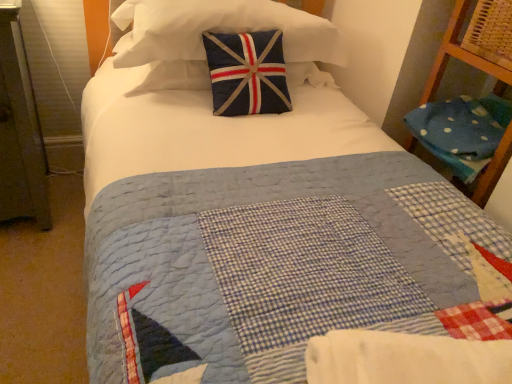
What do you see at coordinates (219, 30) in the screenshot? Image resolution: width=512 pixels, height=384 pixels. I see `navy blue fabric pillow at upper center, the 2th pillow in the bottom-to-top sequence` at bounding box center [219, 30].

What is the approximate width of white cotton blanket at center?

white cotton blanket at center is 11.24 inches wide.

Locate an element on the screen. blue polka dot fabric at right, which appears as the 2th pillow when viewed from the left is located at coordinates (461, 126).

You are a GUI agent. You are given a task and a screenshot of the screen. Output one action in this format:
    pyautogui.click(x=<x>, y=<y>)
    Task: Click on the 2nd pillow positioned above the white cotton blanket at center (from the image's perspective)
    This screenshot has width=512, height=384.
    Given the screenshot: What is the action you would take?
    pyautogui.click(x=219, y=30)

How much distance is there between navy blue fabric pillow at upper center, the second pillow when ordered from right to left, and white cotton blanket at center?

navy blue fabric pillow at upper center, the second pillow when ordered from right to left, and white cotton blanket at center are 3.71 feet apart from each other.

Are navy blue fabric pillow at upper center, acting as the first pillow starting from the left, and white cotton blanket at center located far from each other?

Absolutely, navy blue fabric pillow at upper center, acting as the first pillow starting from the left, is distant from white cotton blanket at center.

Is navy blue fabric pillow at upper center, acting as the first pillow starting from the left, wider than white cotton blanket at center?

Indeed, navy blue fabric pillow at upper center, acting as the first pillow starting from the left, has a greater width compared to white cotton blanket at center.

Could you measure the distance between white cotton blanket at center and blue polka dot fabric at right, which is the 1th pillow from right to left?

37.06 inches.

Which is farther, [382,363] or [453,133]?

Positioned behind is point [453,133].

From the picture: Does white cotton blanket at center appear on the right side of blue polka dot fabric at right, which appears as the 2th pillow when viewed from the left?

In fact, white cotton blanket at center is to the left of blue polka dot fabric at right, which appears as the 2th pillow when viewed from the left.

From the image's perspective, which is above, white cotton blanket at center or blue polka dot fabric at right, which is the 1th pillow from right to left?

blue polka dot fabric at right, which is the 1th pillow from right to left, is shown above in the image.

Considering the relative positions of blue polka dot fabric at right, which appears as the 2th pillow when viewed from the left, and navy blue fabric pillow at upper center, the second pillow when ordered from right to left, in the image provided, is blue polka dot fabric at right, which appears as the 2th pillow when viewed from the left, to the right of navy blue fabric pillow at upper center, the second pillow when ordered from right to left, from the viewer's perspective?

Indeed, blue polka dot fabric at right, which appears as the 2th pillow when viewed from the left, is positioned on the right side of navy blue fabric pillow at upper center, the second pillow when ordered from right to left.

Is blue polka dot fabric at right, the 1th pillow from the bottom, in front of or behind navy blue fabric pillow at upper center, which is the 1th pillow from top to bottom, in the image?

Visually, blue polka dot fabric at right, the 1th pillow from the bottom, is located behind navy blue fabric pillow at upper center, which is the 1th pillow from top to bottom.

Locate an element on the screen. The width and height of the screenshot is (512, 384). pillow that is behind the navy blue fabric pillow at upper center, acting as the first pillow starting from the left is located at coordinates (461, 126).

Could you tell me if blue polka dot fabric at right, which appears as the 2th pillow when viewed from the left, is turned towards navy blue fabric pillow at upper center, the 2th pillow in the bottom-to-top sequence?

No, blue polka dot fabric at right, which appears as the 2th pillow when viewed from the left, is not aimed at navy blue fabric pillow at upper center, the 2th pillow in the bottom-to-top sequence.

From a real-world perspective, is blue polka dot fabric at right, which appears as the 2th pillow when viewed from the left, on white cotton blanket at center?

No, from a real-world perspective, blue polka dot fabric at right, which appears as the 2th pillow when viewed from the left, is not over white cotton blanket at center

Looking at their sizes, would you say blue polka dot fabric at right, positioned as the 2th pillow in top-to-bottom order, is wider or thinner than white cotton blanket at center?

Clearly, blue polka dot fabric at right, positioned as the 2th pillow in top-to-bottom order, has more width compared to white cotton blanket at center.

Is white cotton blanket at center located within blue polka dot fabric at right, the 1th pillow from the bottom?

No.

Which is more distant, (490,150) or (474,346)?

The point (490,150) is behind.

Is white cotton blanket at center turned away from navy blue fabric pillow at upper center, which is the 1th pillow from top to bottom?

Yes.

Is navy blue fabric pillow at upper center, acting as the first pillow starting from the left, located within white cotton blanket at center?

Definitely not — navy blue fabric pillow at upper center, acting as the first pillow starting from the left, is not inside white cotton blanket at center.

Identify the location of blanket that appears below the navy blue fabric pillow at upper center, the second pillow when ordered from right to left (from the image's perspective). (405, 359).

From a real-world perspective, is white cotton blanket at center under navy blue fabric pillow at upper center, the 2th pillow in the bottom-to-top sequence?

Yes, from a real-world perspective, white cotton blanket at center is under navy blue fabric pillow at upper center, the 2th pillow in the bottom-to-top sequence.

Which object is wider, navy blue fabric pillow at upper center, acting as the first pillow starting from the left, or blue polka dot fabric at right, which appears as the 2th pillow when viewed from the left?

blue polka dot fabric at right, which appears as the 2th pillow when viewed from the left.

Is navy blue fabric pillow at upper center, the 2th pillow in the bottom-to-top sequence, facing towards blue polka dot fabric at right, which is the 1th pillow from right to left?

No.

Is navy blue fabric pillow at upper center, the 2th pillow in the bottom-to-top sequence, completely or partially outside of blue polka dot fabric at right, which is the 1th pillow from right to left?

Indeed, navy blue fabric pillow at upper center, the 2th pillow in the bottom-to-top sequence, is completely outside blue polka dot fabric at right, which is the 1th pillow from right to left.

Considering the relative positions of navy blue fabric pillow at upper center, acting as the first pillow starting from the left, and blue polka dot fabric at right, positioned as the 2th pillow in top-to-bottom order, in the image provided, is navy blue fabric pillow at upper center, acting as the first pillow starting from the left, in front of blue polka dot fabric at right, positioned as the 2th pillow in top-to-bottom order,?

Yes, navy blue fabric pillow at upper center, acting as the first pillow starting from the left, is closer to the camera.

Find the location of `pillow that appears on the left of white cotton blanket at center`. pillow that appears on the left of white cotton blanket at center is located at coordinates (219, 30).

Find the location of a particular element. The height and width of the screenshot is (384, 512). blanket above the blue polka dot fabric at right, which appears as the 2th pillow when viewed from the left (from a real-world perspective) is located at coordinates (405, 359).

Looking at the image, which one is located further to blue polka dot fabric at right, which is the 1th pillow from right to left, navy blue fabric pillow at upper center, which is the 1th pillow from top to bottom, or white cotton blanket at center?

Based on the image, white cotton blanket at center appears to be further to blue polka dot fabric at right, which is the 1th pillow from right to left.

Which object lies further to the anchor point navy blue fabric pillow at upper center, the 2th pillow in the bottom-to-top sequence, blue polka dot fabric at right, the 1th pillow from the bottom, or white cotton blanket at center?

white cotton blanket at center lies further to navy blue fabric pillow at upper center, the 2th pillow in the bottom-to-top sequence, than the other object.

Considering their positions, is white cotton blanket at center positioned further to navy blue fabric pillow at upper center, which is the 1th pillow from top to bottom, than blue polka dot fabric at right, which is the 1th pillow from right to left?

Among the two, white cotton blanket at center is located further to navy blue fabric pillow at upper center, which is the 1th pillow from top to bottom.

When comparing their distances from white cotton blanket at center, does navy blue fabric pillow at upper center, acting as the first pillow starting from the left, or blue polka dot fabric at right, positioned as the 2th pillow in top-to-bottom order, seem further?

The object further to white cotton blanket at center is navy blue fabric pillow at upper center, acting as the first pillow starting from the left.

Which object lies further to the anchor point blue polka dot fabric at right, which appears as the 2th pillow when viewed from the left, white cotton blanket at center or navy blue fabric pillow at upper center, which is the 1th pillow from top to bottom?

The object further to blue polka dot fabric at right, which appears as the 2th pillow when viewed from the left, is white cotton blanket at center.

When comparing their distances from white cotton blanket at center, does blue polka dot fabric at right, the 1th pillow from the bottom, or navy blue fabric pillow at upper center, the 2th pillow in the bottom-to-top sequence, seem further?

Among the two, navy blue fabric pillow at upper center, the 2th pillow in the bottom-to-top sequence, is located further to white cotton blanket at center.

Identify the location of pillow between white cotton blanket at center and blue polka dot fabric at right, which is the 1th pillow from right to left, along the z-axis. The height and width of the screenshot is (384, 512). (219, 30).